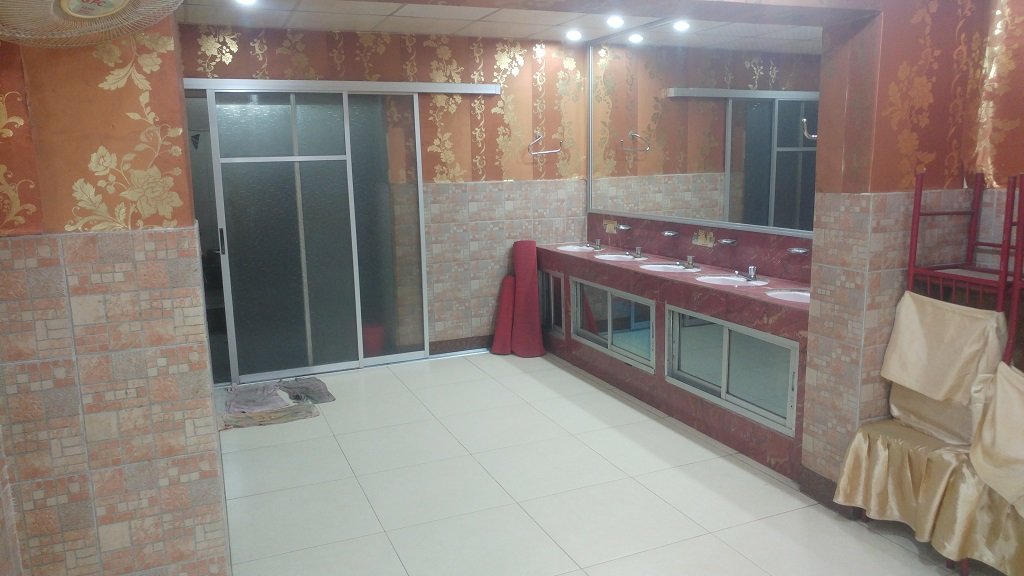
Identify the location of reflections of lights. The image size is (1024, 576). (682, 26), (636, 41).